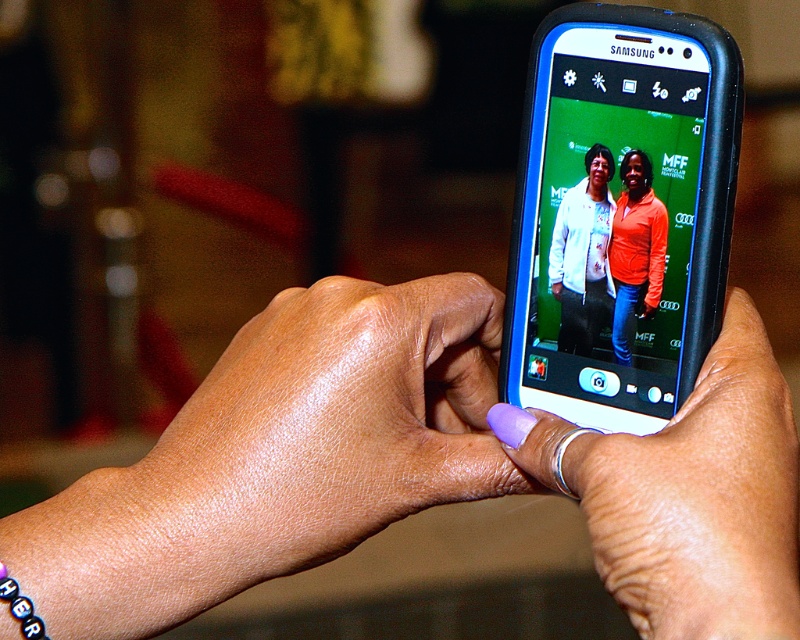
Consider the image. Can you confirm if white matte jacket at center is wider than orange fleece jacket at center?

Yes, white matte jacket at center is wider than orange fleece jacket at center.

Who is shorter, white matte jacket at center or orange fleece jacket at center?

orange fleece jacket at center

Find the location of a particular element. This screenshot has width=800, height=640. white matte jacket at center is located at coordinates (582, 256).

Find the location of `white matte jacket at center`. white matte jacket at center is located at coordinates (582, 256).

Which is more to the left, purple acrylic nail at center or orange fleece jacket at center?

Positioned to the left is purple acrylic nail at center.

This screenshot has width=800, height=640. Describe the element at coordinates (701, 499) in the screenshot. I see `purple acrylic nail at center` at that location.

I want to click on purple acrylic nail at center, so click(x=701, y=499).

Is blue plastic phone at center further to the viewer compared to orange fleece jacket at center?

No, blue plastic phone at center is closer to the viewer.

Can you confirm if blue plastic phone at center is positioned to the left of orange fleece jacket at center?

Correct, you'll find blue plastic phone at center to the left of orange fleece jacket at center.

Locate an element on the screen. This screenshot has height=640, width=800. blue plastic phone at center is located at coordinates (616, 225).